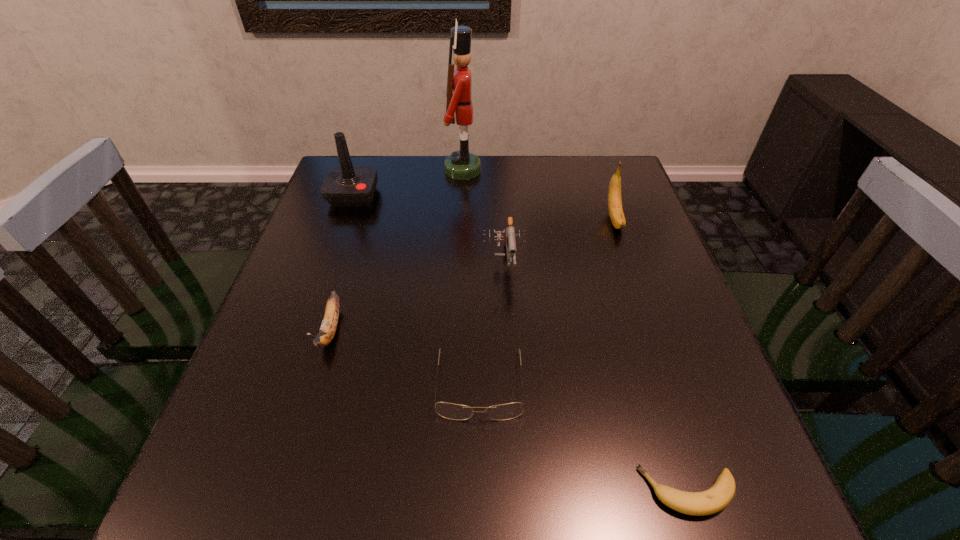
Locate an element on the screen. The width and height of the screenshot is (960, 540). the nearest object is located at coordinates (716, 498).

At what (x,y) coordinates should I click in order to perform the action: click on the shortest object. Please return your answer as a coordinate pair (x, y). Image resolution: width=960 pixels, height=540 pixels. Looking at the image, I should click on (716, 498).

What are the coordinates of `free space located on the front-facing side of the tallest object` in the screenshot? It's located at (528, 171).

This screenshot has width=960, height=540. What are the coordinates of `free region located on the back of the joystick` in the screenshot? It's located at (365, 164).

Locate an element on the screen. This screenshot has height=540, width=960. free region located at the start of the peel on the tallest banana is located at coordinates (633, 272).

At what (x,y) coordinates should I click in order to perform the action: click on vacant space located 0.210m at the barrel end of the fourth tallest object. Please return your answer as a coordinate pair (x, y). This screenshot has width=960, height=540. Looking at the image, I should click on (510, 366).

The height and width of the screenshot is (540, 960). In order to click on free spot located 0.050m at the stem of the second farthest banana in this screenshot , I will do `click(315, 382)`.

Where is `vacant space located on the front-facing side of the spectacles`? vacant space located on the front-facing side of the spectacles is located at coordinates (480, 470).

Locate an element on the screen. Image resolution: width=960 pixels, height=540 pixels. blank space located 0.390m at the stem of the shortest banana is located at coordinates (385, 491).

Locate an element on the screen. Image resolution: width=960 pixels, height=540 pixels. free space located 0.190m at the stem of the shortest banana is located at coordinates (516, 491).